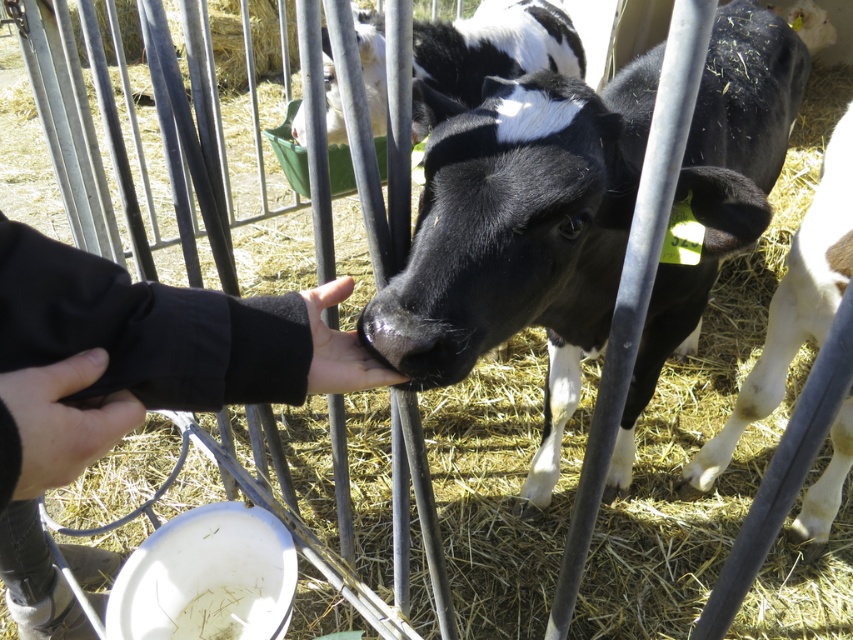
Who is shorter, black fleece sleeve at center or black and white fur at center?

Standing shorter between the two is black fleece sleeve at center.

Between black fleece sleeve at center and black and white fur at center, which one appears on the left side from the viewer's perspective?

Positioned to the left is black fleece sleeve at center.

Image resolution: width=853 pixels, height=640 pixels. In order to click on black fleece sleeve at center in this screenshot , I will do `click(143, 364)`.

This screenshot has width=853, height=640. I want to click on black fleece sleeve at center, so click(143, 364).

Which of these two, black and white cow at center or black fleece sleeve at center, stands taller?

Standing taller between the two is black and white cow at center.

Between black and white cow at center and black fleece sleeve at center, which one is positioned lower?

black fleece sleeve at center

Who is more distant from viewer, (x=711, y=252) or (x=300, y=385)?

The point (x=711, y=252) is more distant.

Locate an element on the screen. This screenshot has width=853, height=640. black and white cow at center is located at coordinates (519, 234).

Between black fleece sleeve at center and black soft hand at center, which one appears on the right side from the viewer's perspective?

black fleece sleeve at center is more to the right.

Which of these two, black fleece sleeve at center or black soft hand at center, stands taller?

black fleece sleeve at center

Is point (254, 353) closer to viewer compared to point (28, 422)?

That is False.

Find the location of `black fleece sleeve at center`. black fleece sleeve at center is located at coordinates (143, 364).